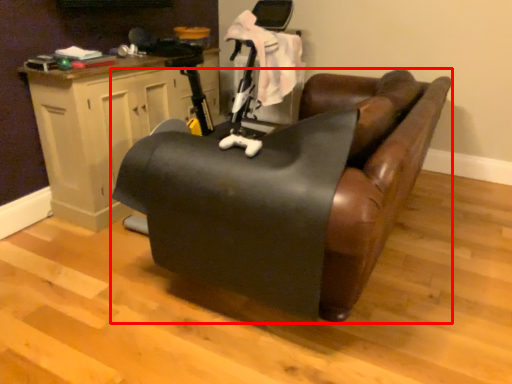
Question: In this image, where is furniture (annotated by the red box) located relative to table?

Choices:
 (A) right
 (B) left

Answer: (A)